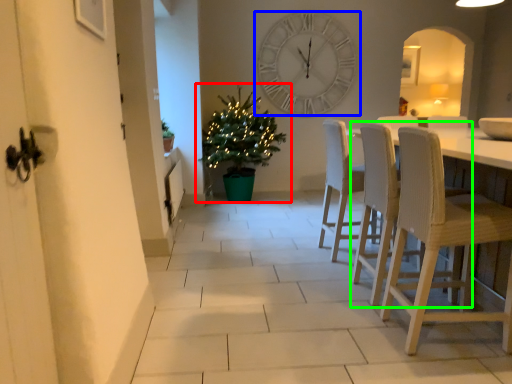
Question: Which object is positioned closest to houseplant (highlighted by a red box)? Select from wall clock (highlighted by a blue box) and chair (highlighted by a green box).

Choices:
 (A) wall clock
 (B) chair

Answer: (A)